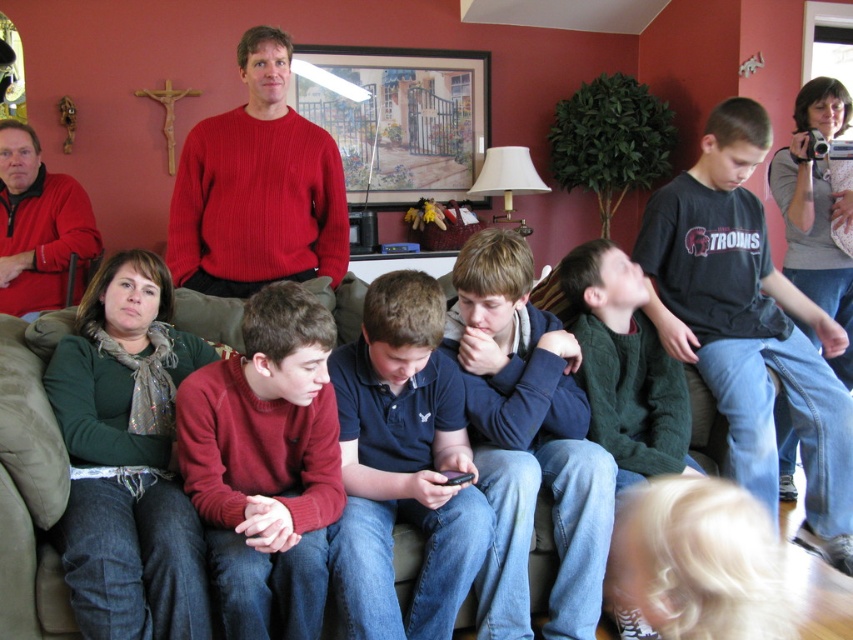
Does ribbed red sweater at upper center appear over framed artwork at upper center?

No, ribbed red sweater at upper center is not above framed artwork at upper center.

Who is more forward, (308, 157) or (355, 100)?

Point (308, 157)

Where is `ribbed red sweater at upper center`? Image resolution: width=853 pixels, height=640 pixels. ribbed red sweater at upper center is located at coordinates (257, 188).

From the picture: Is the position of framed artwork at upper center more distant than that of green sweater at center?

That is True.

Is point (349, 96) farther from camera compared to point (614, 264)?

Yes, it is behind point (614, 264).

Does point (363, 58) come behind point (572, 292)?

Yes, point (363, 58) is farther from viewer.

The image size is (853, 640). Find the location of `framed artwork at upper center`. framed artwork at upper center is located at coordinates (397, 116).

Is dark blue polo shirt at center wider than brown fabric couch at lower center?

Incorrect, dark blue polo shirt at center's width does not surpass brown fabric couch at lower center's.

Does point (350, 572) come behind point (35, 342)?

No, it is in front of (35, 342).

Which is in front, point (346, 404) or point (210, 326)?

Point (346, 404) is in front.

This screenshot has height=640, width=853. I want to click on dark blue polo shirt at center, so click(x=402, y=465).